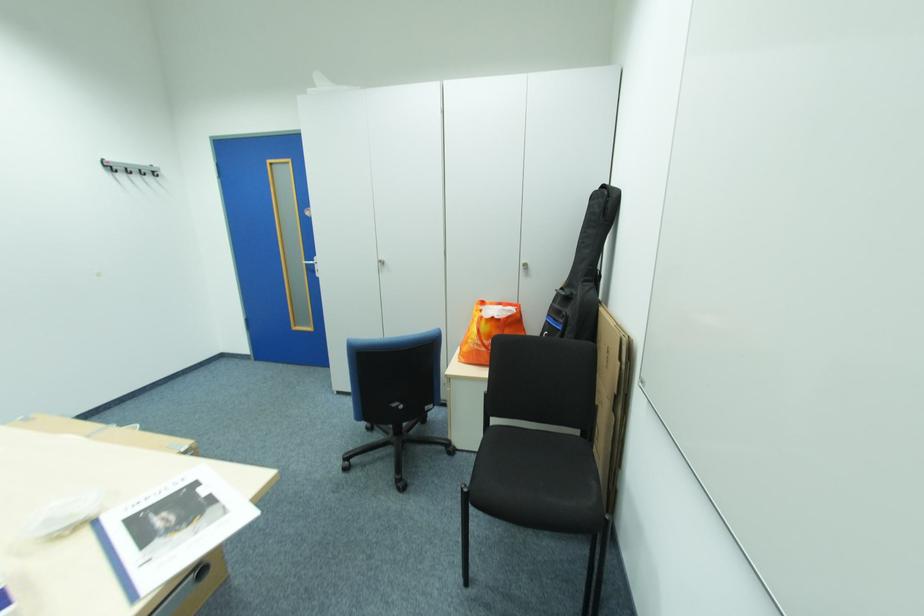
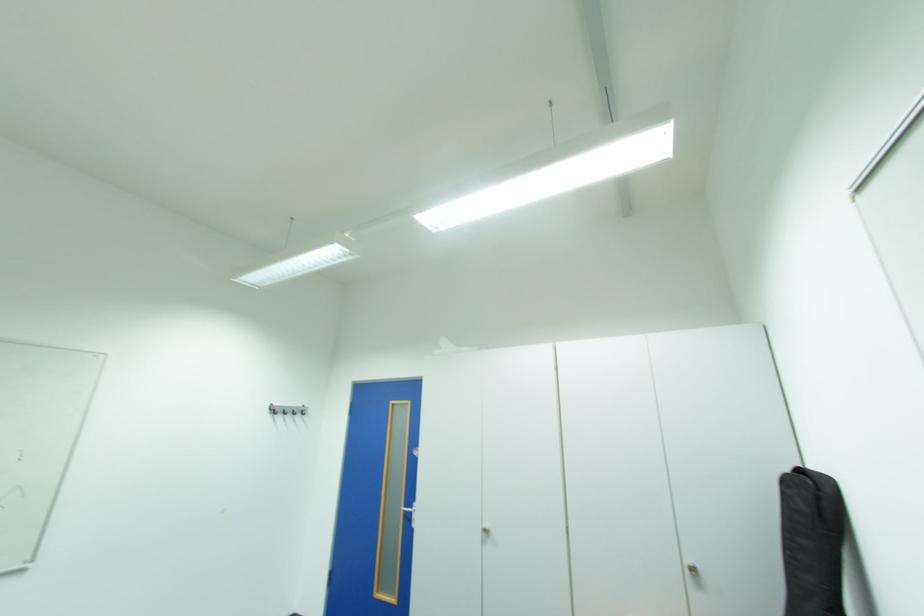
Locate, in the second image, the point that corresponds to pixel 391 262 in the first image.

(495, 532)